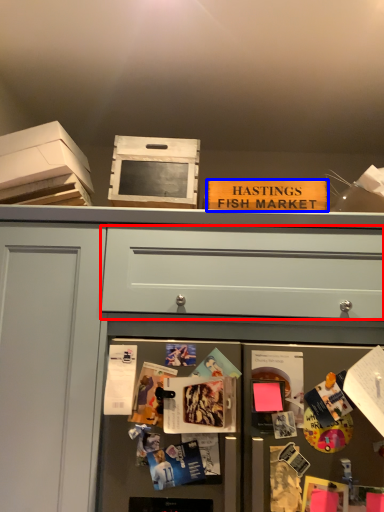
Question: Which object appears farthest to the camera in this image, drawer (highlighted by a red box) or magazine (highlighted by a blue box)?

Choices:
 (A) drawer
 (B) magazine

Answer: (B)